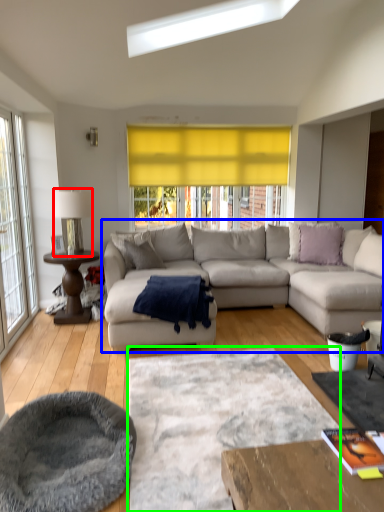
Question: Which object is positioned closest to lamp (highlighted by a red box)? Select from studio couch (highlighted by a blue box) and plain (highlighted by a green box).

Choices:
 (A) studio couch
 (B) plain

Answer: (A)